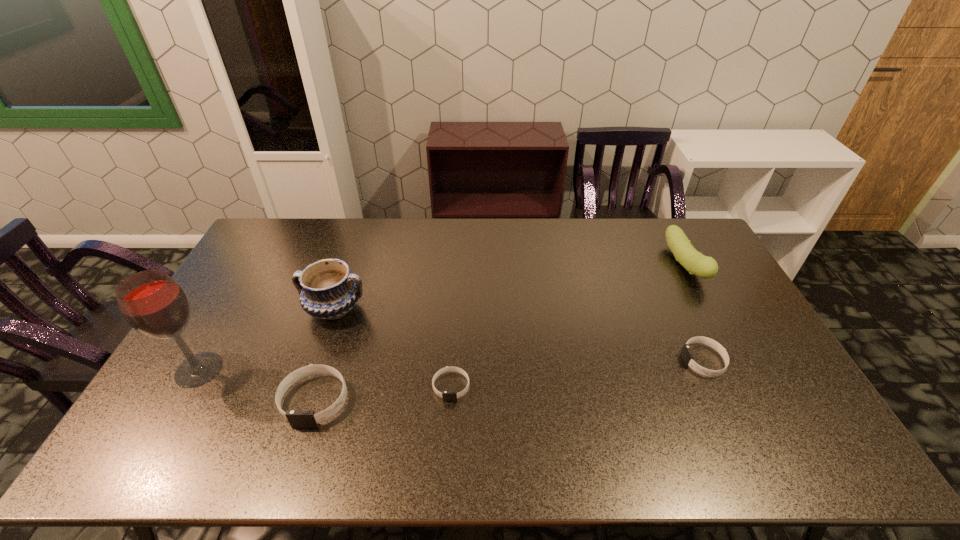
Identify the location of cucumber situated at the right edge. Image resolution: width=960 pixels, height=540 pixels. (696, 263).

The image size is (960, 540). In order to click on object situated at the far right corner in this screenshot , I will do `click(696, 263)`.

Locate an element on the screen. The height and width of the screenshot is (540, 960). blank space at the far edge of the desktop is located at coordinates (658, 242).

What are the coordinates of `vacant space at the near edge of the desktop` in the screenshot? It's located at (245, 400).

In order to click on vacant space at the right edge of the desktop in this screenshot , I will do `click(754, 334)`.

In the image, there is a desktop. Identify the location of free space at the near left corner. This screenshot has height=540, width=960. (200, 412).

Locate an element on the screen. The height and width of the screenshot is (540, 960). vacant space at the near right corner of the desktop is located at coordinates (790, 394).

This screenshot has width=960, height=540. I want to click on empty location between the alcohol and the pottery, so click(267, 339).

Locate an element on the screen. Image resolution: width=960 pixels, height=540 pixels. free space that is in between the alcohol and the tallest wristband is located at coordinates (257, 385).

Locate an element on the screen. The height and width of the screenshot is (540, 960). unoccupied area between the pottery and the tallest object is located at coordinates (267, 339).